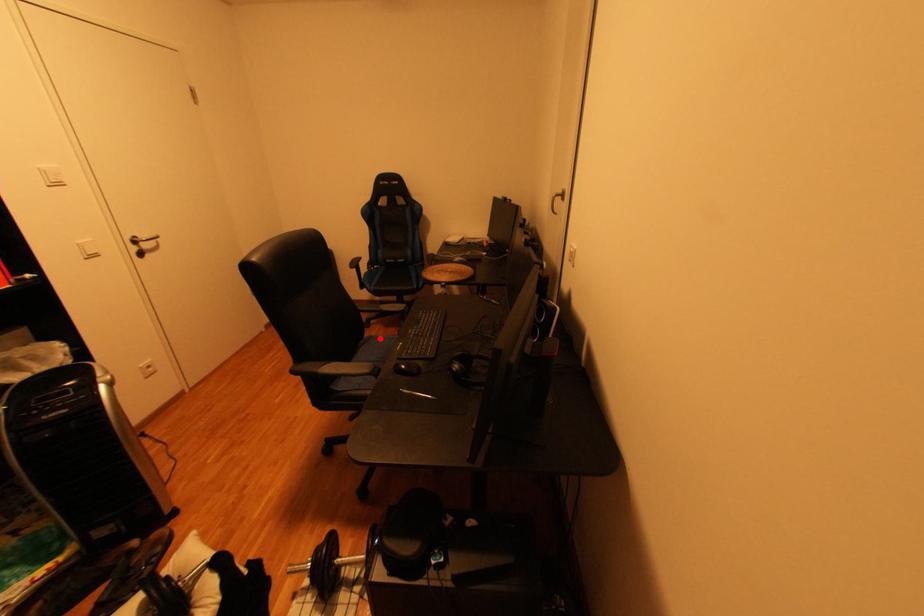
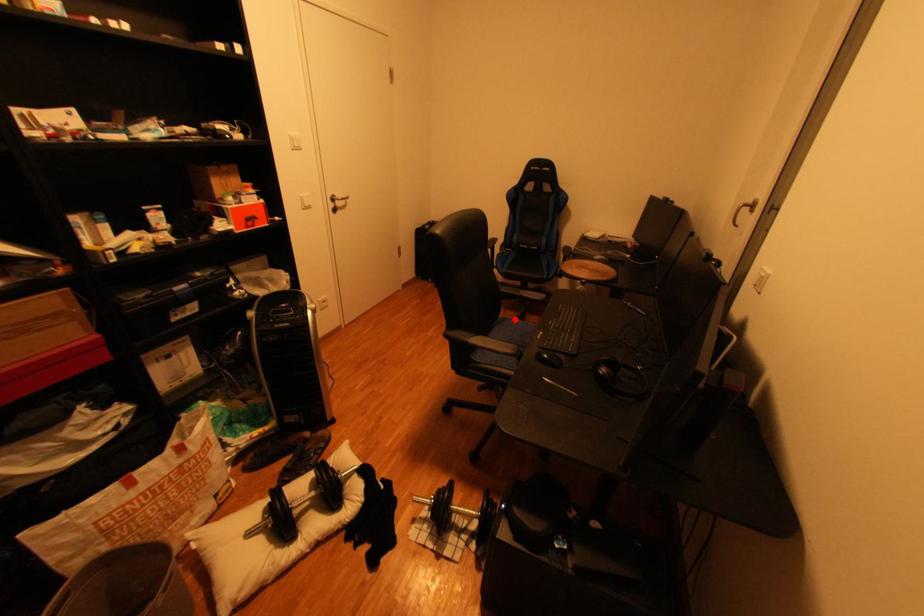
I am providing you with two images of the same scene from different viewpoints. A red point is marked on the first image and another point is marked on the second image. Does the point marked in image1 correspond to the same location as the one in image2?

Yes